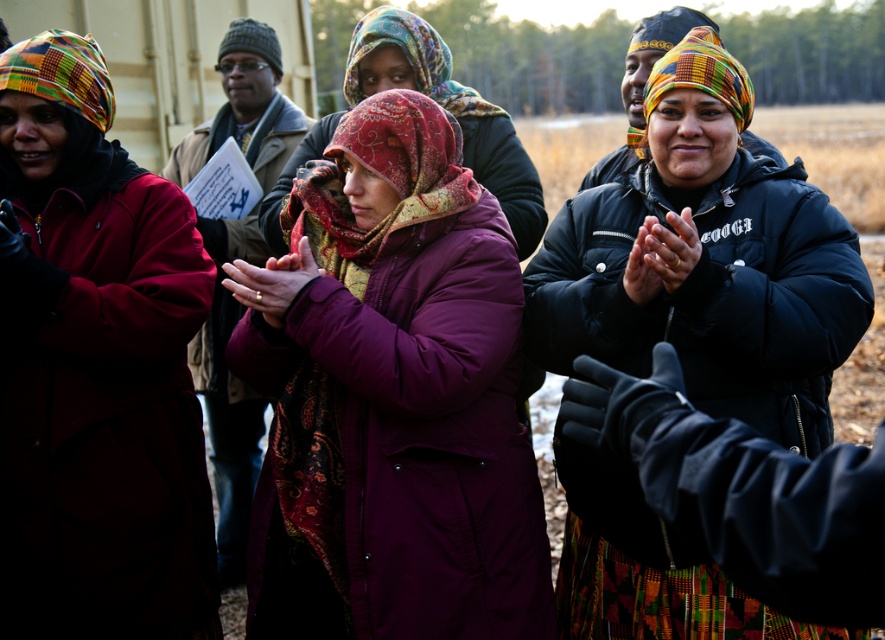
Based on the photo, what is the color of the jacket located at point [705,260]?

The jacket at point [705,260] is matte black.

You are standing at point (x=436, y=154) and want to walk to the central figure in the purple coat and red patterned scarf. Is the path blocked by the point at (x=405, y=42)?

Point (x=405, y=42) is behind point (x=436, y=154), so the path to the central figure is not blocked by the point at (x=405, y=42).